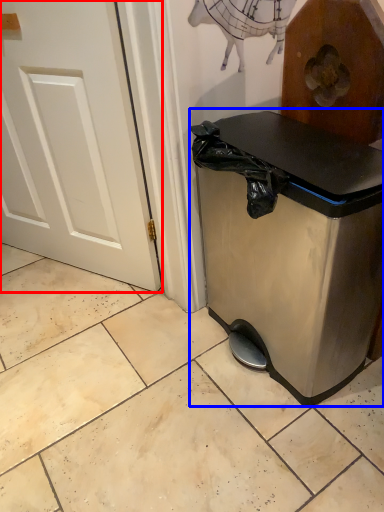
Question: Which object is further to the camera taking this photo, door (highlighted by a red box) or waste container (highlighted by a blue box)?

Choices:
 (A) door
 (B) waste container

Answer: (A)